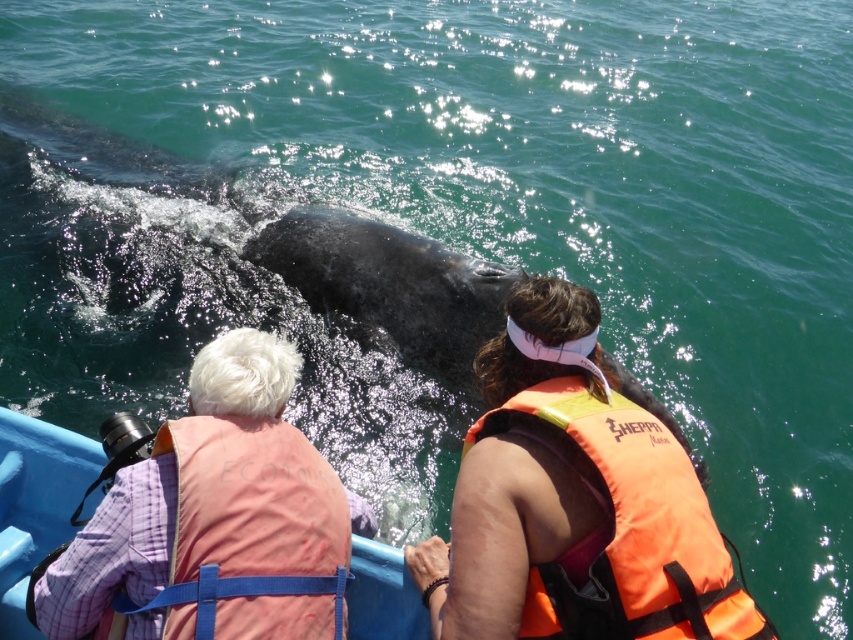
You are on a boat and need to quickly grab a life jacket. Which life jacket is closer to the right side of the boat, the orange fabric life jacket at center or the pink fabric life jacket at upper left?

The orange fabric life jacket at center is to the right of the pink fabric life jacket at upper left, so the orange one is closer to the right side of the boat.